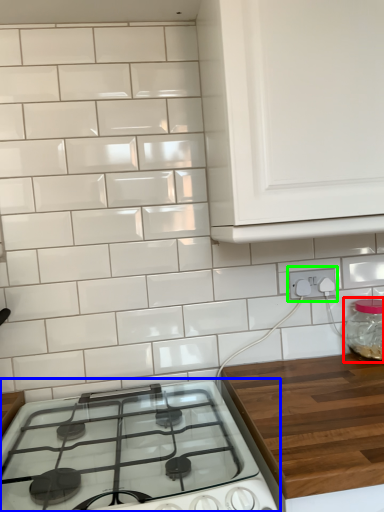
Question: Based on their relative distances, which object is nearer to glass jar (highlighted by a red box)? Choose from gas stove (highlighted by a blue box) and electric outlet (highlighted by a green box).

Choices:
 (A) gas stove
 (B) electric outlet

Answer: (B)